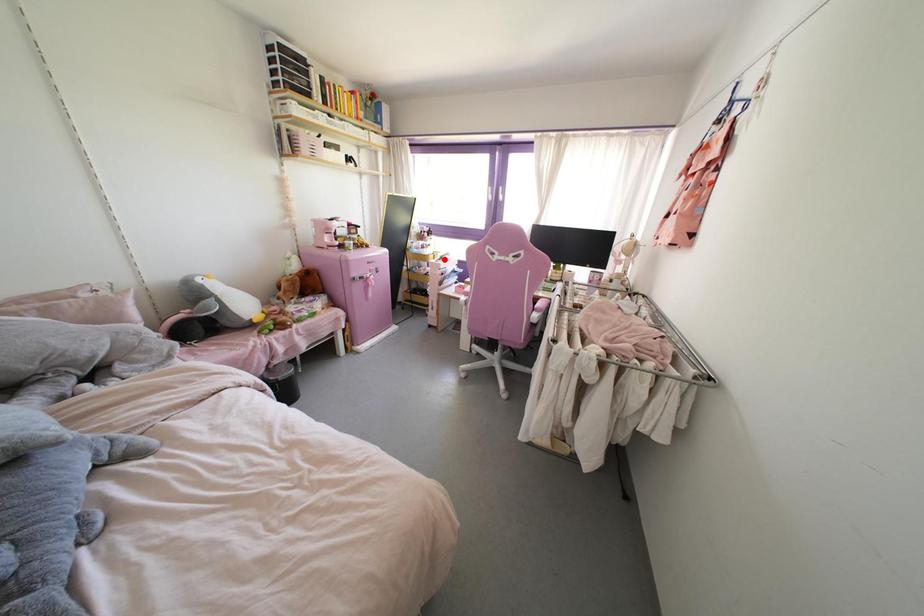
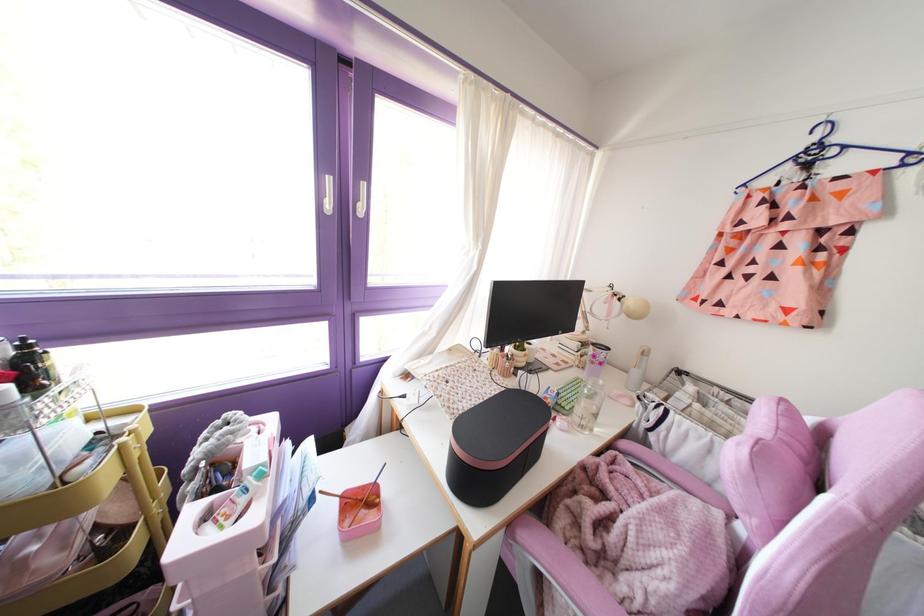
The point at the highlighted location is marked in the first image. Where is the corresponding point in the second image?

(261, 475)